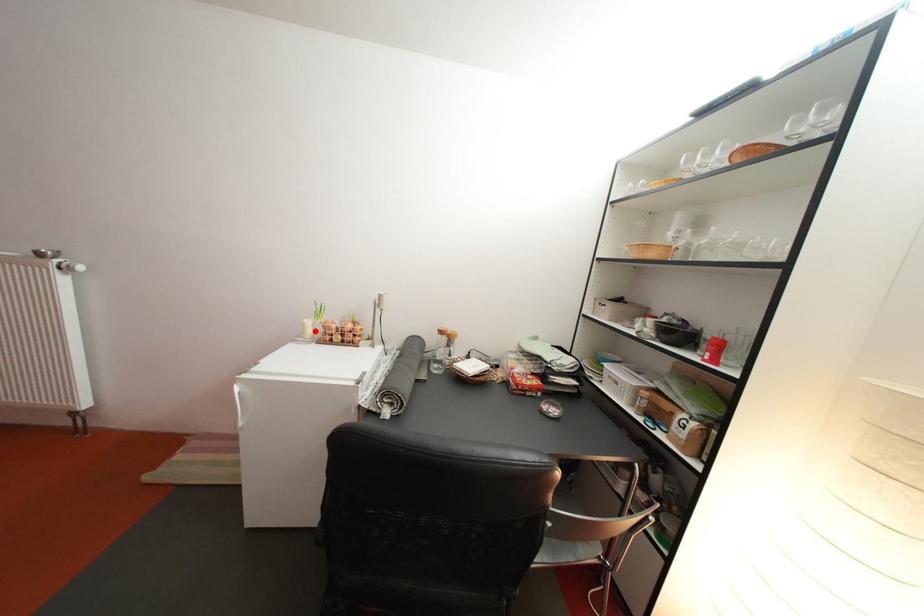
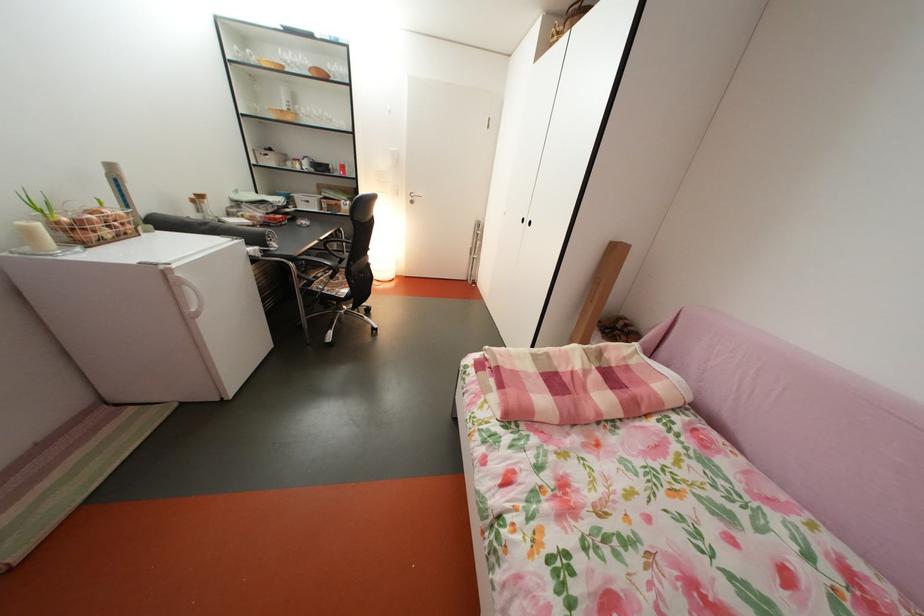
In the second image, find the point that corresponds to the highlighted location in the first image.

(41, 238)